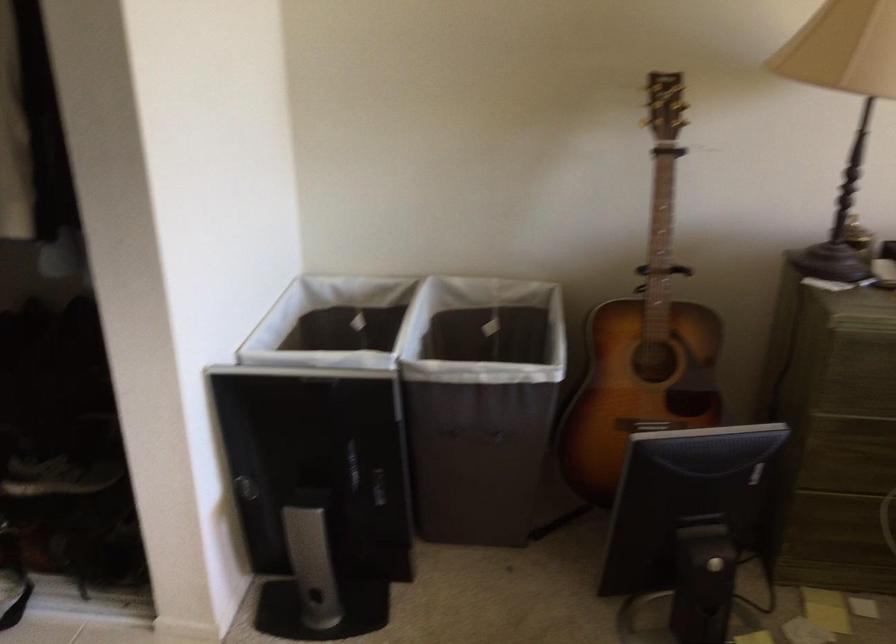
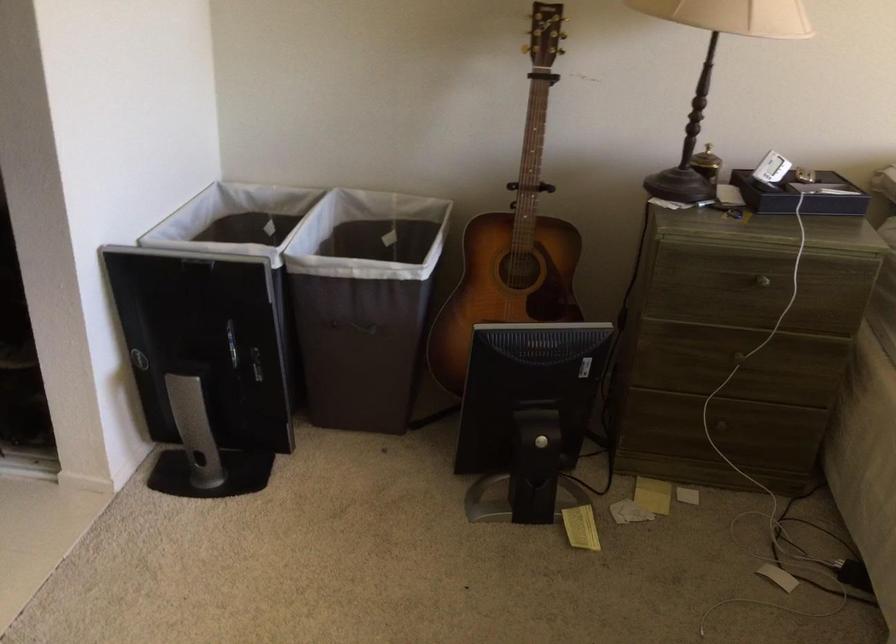
In the second image, find the point that corresponds to pixel 316 496 in the first image.

(203, 365)